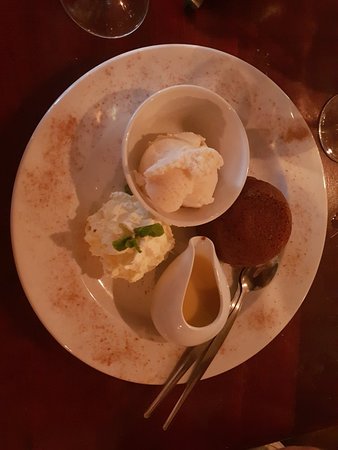
Identify the location of table. This screenshot has height=450, width=338. (37, 388).